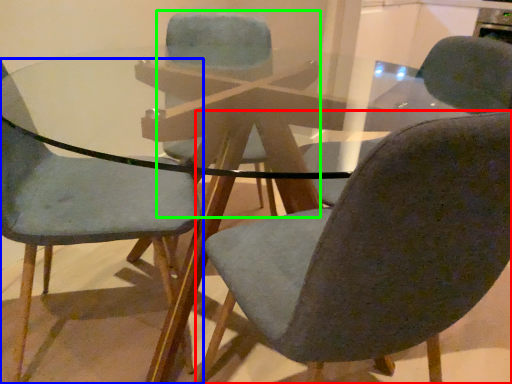
Question: Which object is the closest to the chair (highlighted by a red box)? Choose among these: chair (highlighted by a blue box) or chair (highlighted by a green box).

Choices:
 (A) chair
 (B) chair

Answer: (A)